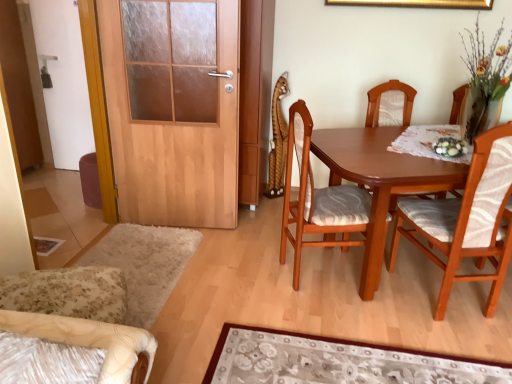
Find the location of a particular element. The width and height of the screenshot is (512, 384). free spot to the left of wooden chair with patterned cushion at right, which appears as the 4th chair when viewed from the left is located at coordinates (379, 307).